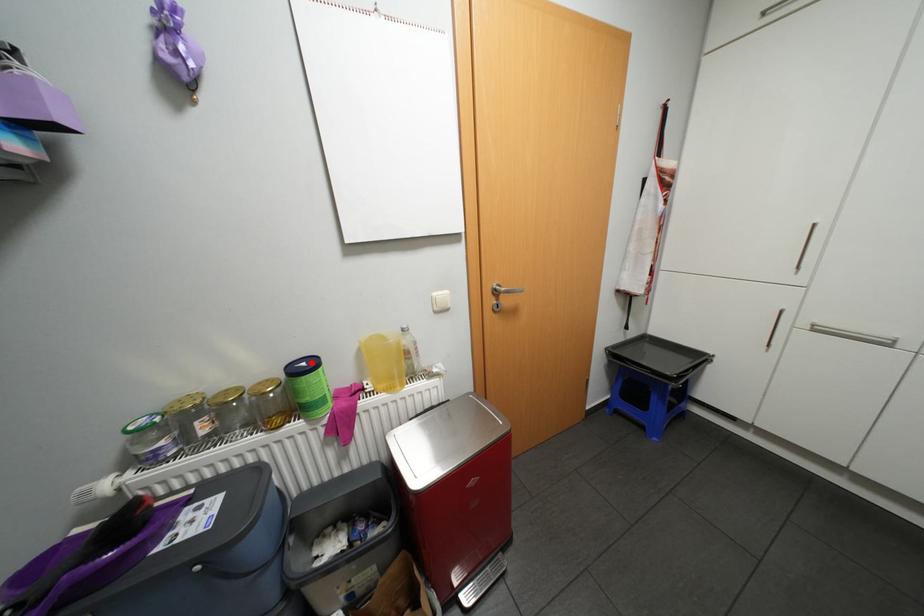
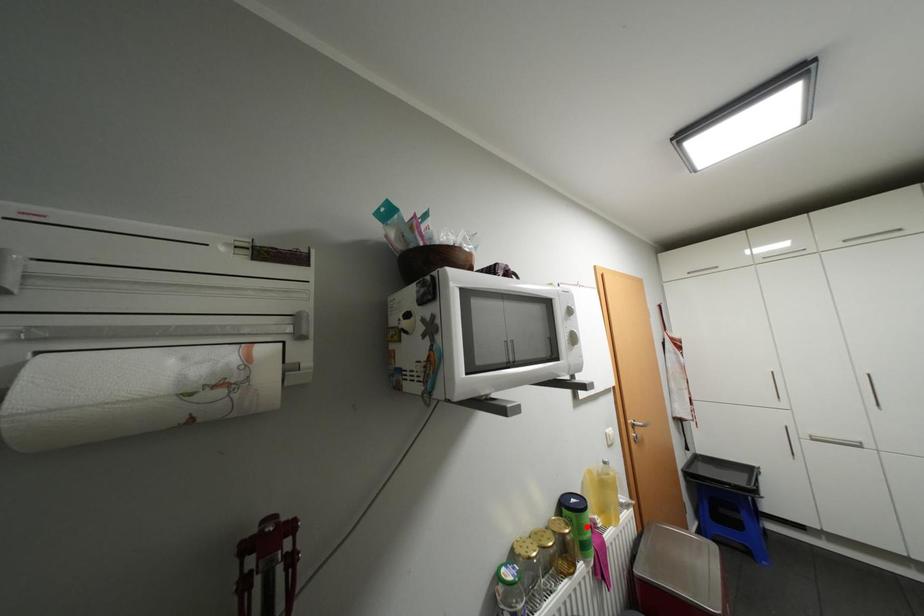
I am providing you with two images of the same scene from different viewpoints. A red point is marked on the first image and another point is marked on the second image. Does the point marked in image1 correspond to the same location as the one in image2?

No